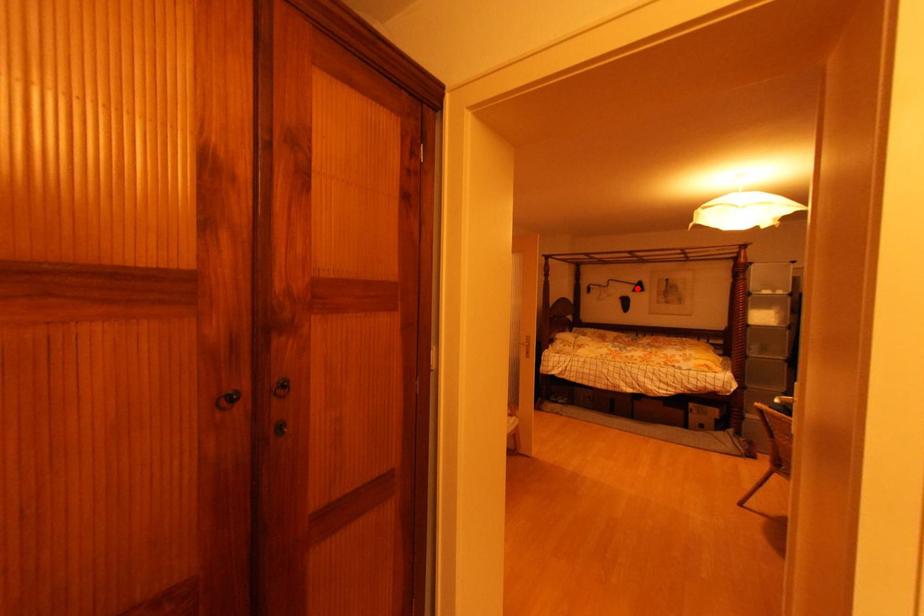
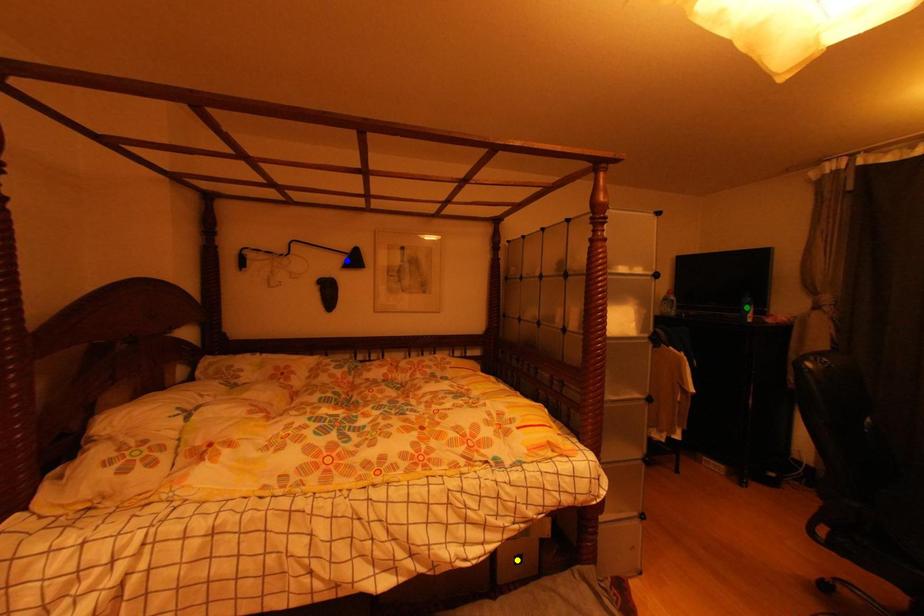
Question: I am providing you with two images of the same scene from different viewpoints. A red point is marked on the first image. You are given multiple points on the second image. Can you choose the point in image 2 that corresponds to the point in image 1?

Choices:
 (A) blue point
 (B) green point
 (C) yellow point

Answer: (A)